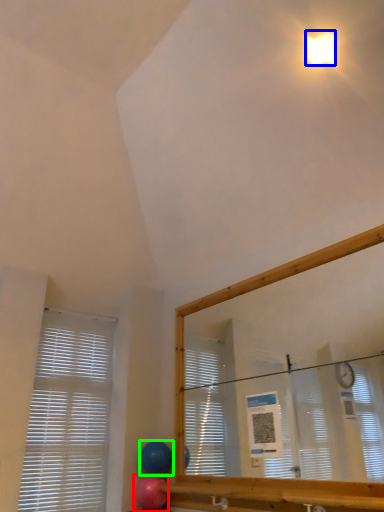
Question: Which object is the farthest from balloon (highlighted by a red box)? Choose among these: light (highlighted by a blue box) or balloon (highlighted by a green box).

Choices:
 (A) light
 (B) balloon

Answer: (A)